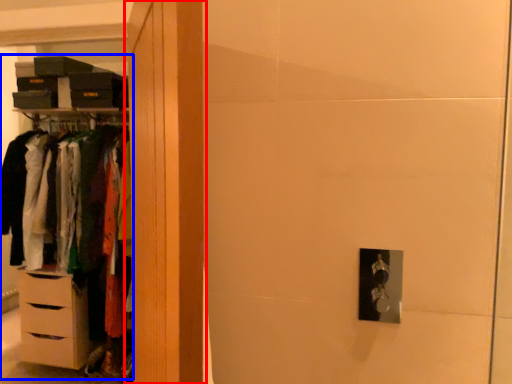
Question: Among these objects, which one is nearest to the camera, armoire (highlighted by a red box) or dresser (highlighted by a blue box)?

Choices:
 (A) armoire
 (B) dresser

Answer: (A)